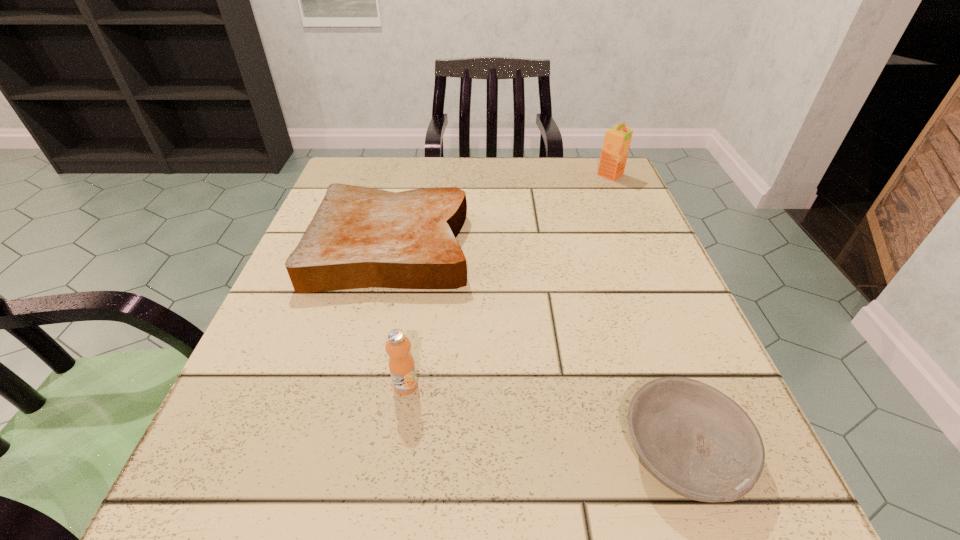
Locate an element on the screen. free spot that satisfies the following two spatial constraints: 1. on the front label of the bowl; 2. on the left side of the nearer orange juice is located at coordinates (396, 451).

Identify the location of blank area in the image that satisfies the following two spatial constraints: 1. on the front label of the shortest object; 2. on the left side of the left orange juice. (396, 451).

Identify the location of vacant space that satisfies the following two spatial constraints: 1. on the front label of the third shortest object; 2. on the left side of the nearest object. This screenshot has height=540, width=960. (396, 451).

Locate an element on the screen. This screenshot has width=960, height=540. free location that satisfies the following two spatial constraints: 1. on the front side of the bowl; 2. on the left side of the second shortest object is located at coordinates (342, 451).